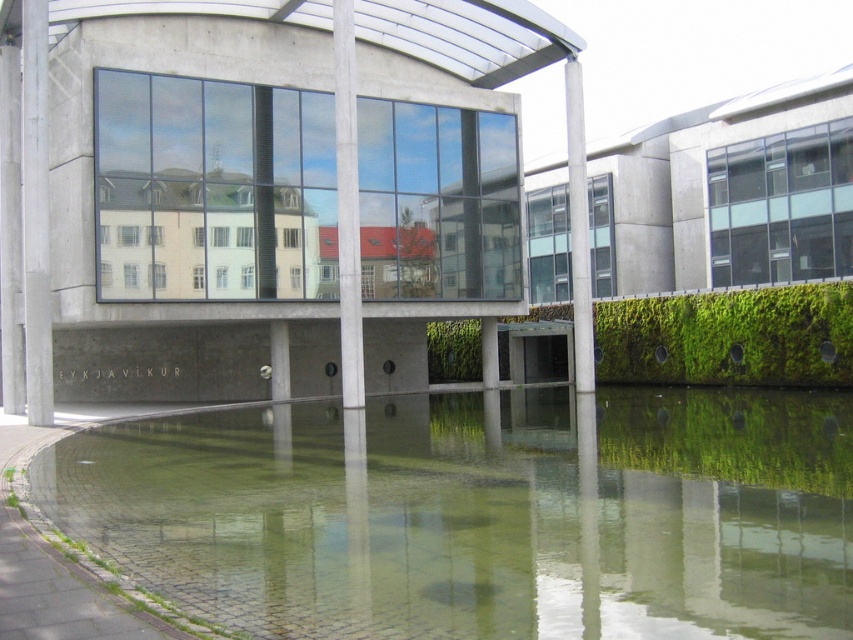
Is point (531, 412) closer to camera compared to point (28, 292)?

No, (531, 412) is behind (28, 292).

The height and width of the screenshot is (640, 853). Identify the location of green mossy pond at lower center. point(480,515).

Find the location of a particular element. green mossy pond at lower center is located at coordinates (480, 515).

Is point (773, 612) behind point (363, 355)?

That is False.

Identify the location of green mossy pond at lower center. This screenshot has width=853, height=640. (480, 515).

Who is lower down, smooth concrete pillar at center or gray concrete pillar at center?

smooth concrete pillar at center is lower down.

Is point (340, 349) positioned behind point (576, 186)?

Yes.

Who is more forward, (354, 148) or (573, 243)?

Point (354, 148) is more forward.

Locate an element on the screen. The width and height of the screenshot is (853, 640). smooth concrete pillar at center is located at coordinates (347, 205).